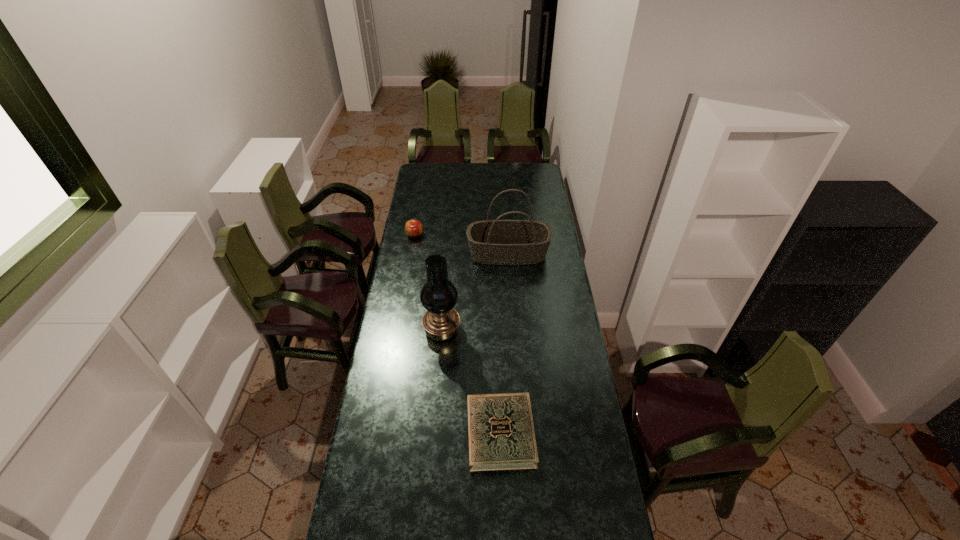
Find the location of `the third object from right to left`. the third object from right to left is located at coordinates (441, 322).

The width and height of the screenshot is (960, 540). Identify the location of the second nearest object. (441, 322).

This screenshot has width=960, height=540. I want to click on the second farthest object, so click(x=493, y=242).

Find the location of `the third shortest object`. the third shortest object is located at coordinates (493, 242).

Where is `apple`? Image resolution: width=960 pixels, height=540 pixels. apple is located at coordinates (413, 228).

Identify the location of the leftmost object. This screenshot has height=540, width=960. (413, 228).

You are a GUI agent. You are given a task and a screenshot of the screen. Output one action in this format:
    pyautogui.click(x=<x>, y=<y>)
    Task: Click on the hardback book
    
    Given the screenshot: What is the action you would take?
    pyautogui.click(x=501, y=433)

At what (x,y) coordinates should I click in order to perform the action: click on the nearest object. Please return your answer as a coordinate pair (x, y). Looking at the image, I should click on (501, 433).

At what (x,y) coordinates should I click in order to perform the action: click on vacant space located 0.080m on the left of the oil lamp. Please return your answer as a coordinate pair (x, y). The width and height of the screenshot is (960, 540). Looking at the image, I should click on (404, 330).

I want to click on free space located 0.270m on the left of the second tallest object, so click(x=415, y=254).